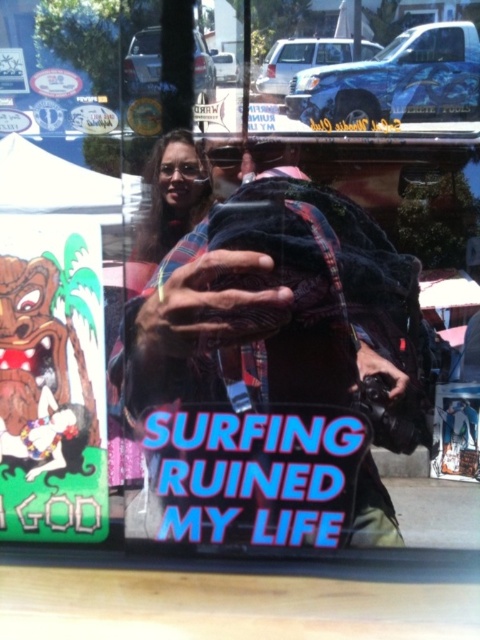
Is plaid fabric at center further to the viewer compared to white paper poster at center?

Yes.

The image size is (480, 640). What do you see at coordinates (168, 204) in the screenshot?
I see `plaid fabric at center` at bounding box center [168, 204].

You are a GUI agent. You are given a task and a screenshot of the screen. Output one action in this format:
    pyautogui.click(x=<x>, y=<y>)
    Task: Click on the plaid fabric at center
    
    Given the screenshot: What is the action you would take?
    pyautogui.click(x=168, y=204)

Describe the element at coordinates (272, 369) in the screenshot. I see `velvet black jacket at center` at that location.

Which is in front, point (167, 531) or point (451, 401)?

Point (451, 401)

Find the location of a particular element. This screenshot has height=640, width=480. velvet black jacket at center is located at coordinates (272, 369).

Measure the distance between point (x=88, y=264) and camera.

Point (x=88, y=264) and camera are 1.74 meters apart from each other.

Describe the element at coordinates (51, 381) in the screenshot. I see `green paper sign at lower left` at that location.

This screenshot has height=640, width=480. I want to click on green paper sign at lower left, so point(51,381).